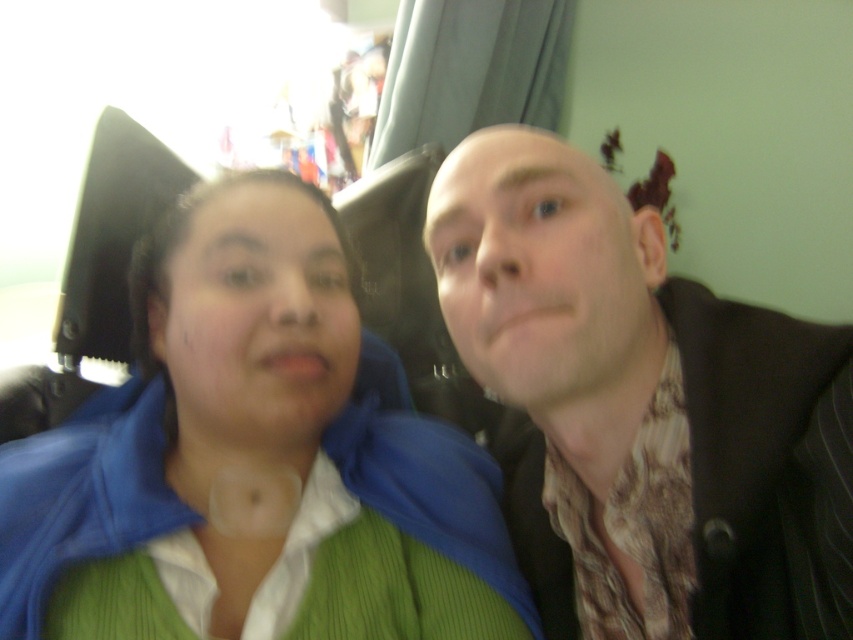
Question: Which point is farther from the camera taking this photo?

Choices:
 (A) (564, 204)
 (B) (445, 552)

Answer: (B)

Question: Which point is closer to the camera?

Choices:
 (A) brown textured scarf at center
 (B) green knitted sweater at center

Answer: (A)

Question: Which point is closer to the camera?

Choices:
 (A) brown textured scarf at center
 (B) green knitted sweater at center

Answer: (A)

Question: Is green knitted sweater at center wider than brown textured scarf at center?

Choices:
 (A) no
 (B) yes

Answer: (B)

Question: Observing the image, what is the correct spatial positioning of green knitted sweater at center in reference to brown textured scarf at center?

Choices:
 (A) right
 (B) left

Answer: (B)

Question: Is green knitted sweater at center closer to the viewer compared to brown textured scarf at center?

Choices:
 (A) yes
 (B) no

Answer: (B)